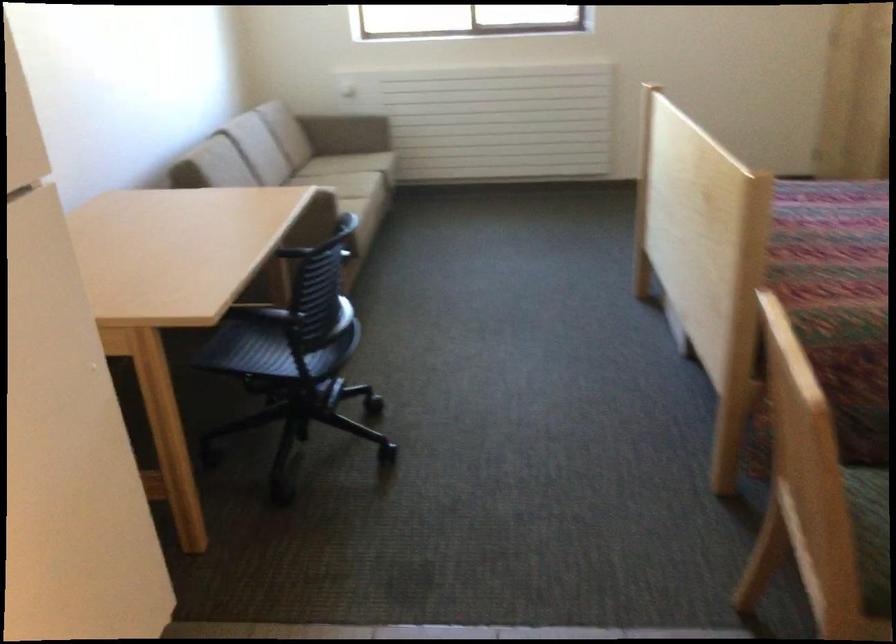
Describe the element at coordinates (288, 326) in the screenshot. This screenshot has width=896, height=644. I see `a chair sitting surface` at that location.